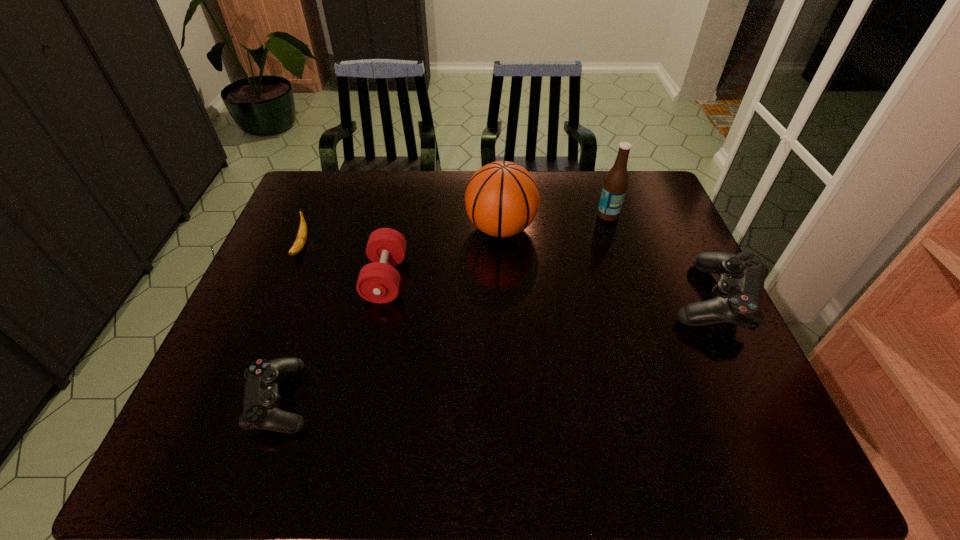
Locate an element on the screen. Image resolution: width=960 pixels, height=540 pixels. object present at the near left corner is located at coordinates (261, 401).

Find the location of a particular element. Image resolution: width=960 pixels, height=540 pixels. vacant point at the far edge is located at coordinates (461, 198).

This screenshot has height=540, width=960. I want to click on vacant position at the near edge of the desktop, so click(433, 381).

Image resolution: width=960 pixels, height=540 pixels. In the image, there is a desktop. Identify the location of vacant region at the left edge. (297, 335).

The image size is (960, 540). I want to click on vacant space at the right edge of the desktop, so click(683, 245).

In the image, there is a desktop. Identify the location of vacant space at the far left corner. (303, 212).

Identify the location of vacant region at the near left corner of the desktop. (209, 386).

In the image, there is a desktop. At what (x,y) coordinates should I click in order to perform the action: click on free region at the far right corner. Please return your answer as a coordinate pair (x, y). This screenshot has width=960, height=540. Looking at the image, I should click on (634, 181).

I want to click on vacant space at the near right corner, so (x=755, y=396).

This screenshot has width=960, height=540. I want to click on free space between the right control and the second object from right to left, so click(660, 257).